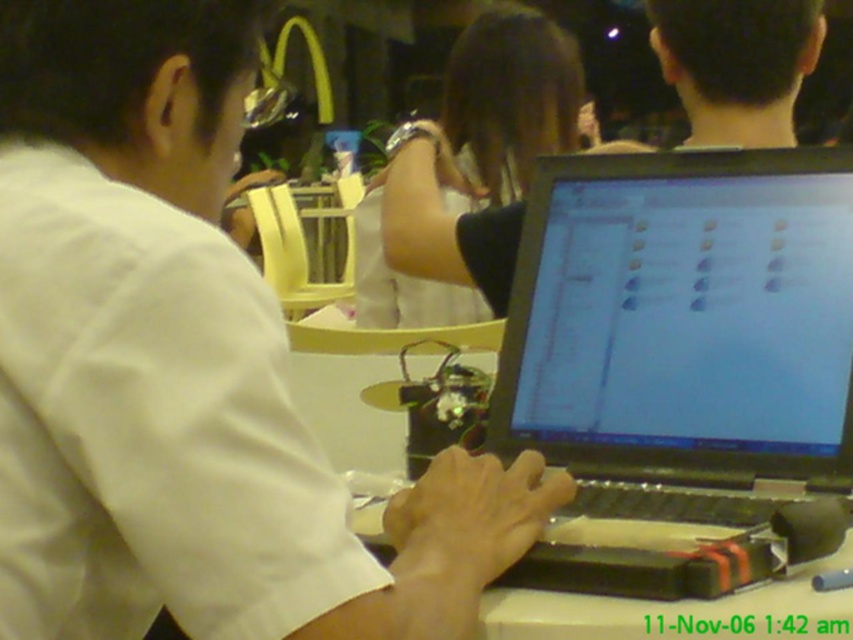
You are organizing a meeting and need to place two laptops on a table that is 80 centimeters wide. You have the matte black laptop at center and the black matte laptop at center. Can both laptops fit side by side on the table without overlapping?

The matte black laptop at center is 44.15 centimeters away from the black matte laptop at center, which indicates the combined width of both laptops is 44.15 cm. Since the table is 80 centimeters wide, there is enough space to place both laptops side by side without overlapping.

You are standing in front of the table where the person with the laptop is working. There are two points marked on the image at coordinates point (809, 339) and point (550, 93). Which of these points is closer to you?

Point (809, 339) is closer to the viewer than point (550, 93).

Based on the photo, you are standing in front of a table where someone is working on a laptop. There is a specific point at coordinates point (181, 212). If you want to place a 12 inch ruler on the table so that it reaches from your current position to that point, will it be long enough?

The distance between you and point (181, 212) is 26.18 inches. Since the ruler is only 12 inches long, it will not be long enough to span the distance.